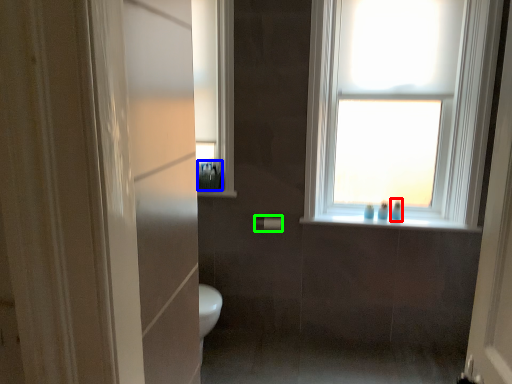
Question: Based on their relative distances, which object is nearer to toiletry (highlighted by a red box)? Choose from toiletry (highlighted by a blue box) and towel bar (highlighted by a green box).

Choices:
 (A) toiletry
 (B) towel bar

Answer: (B)